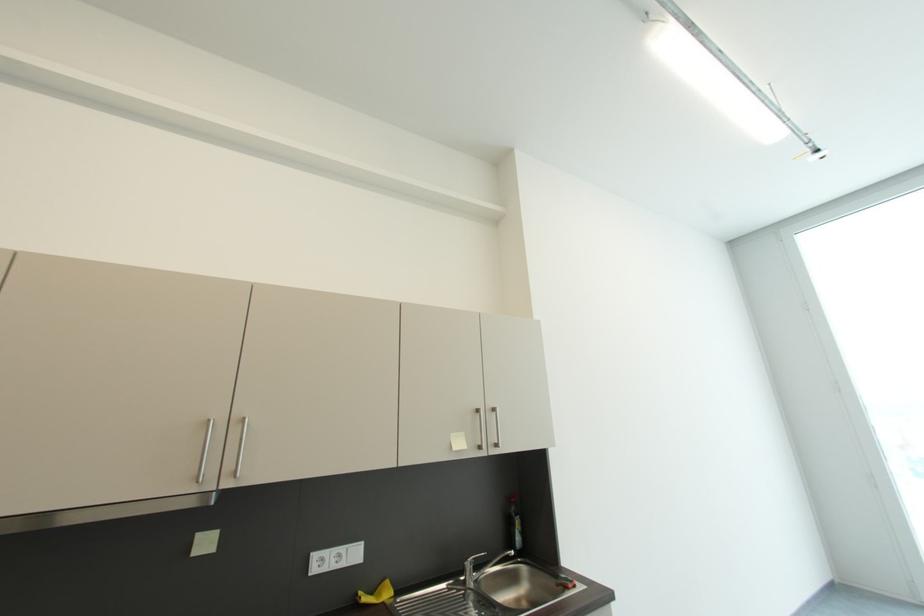
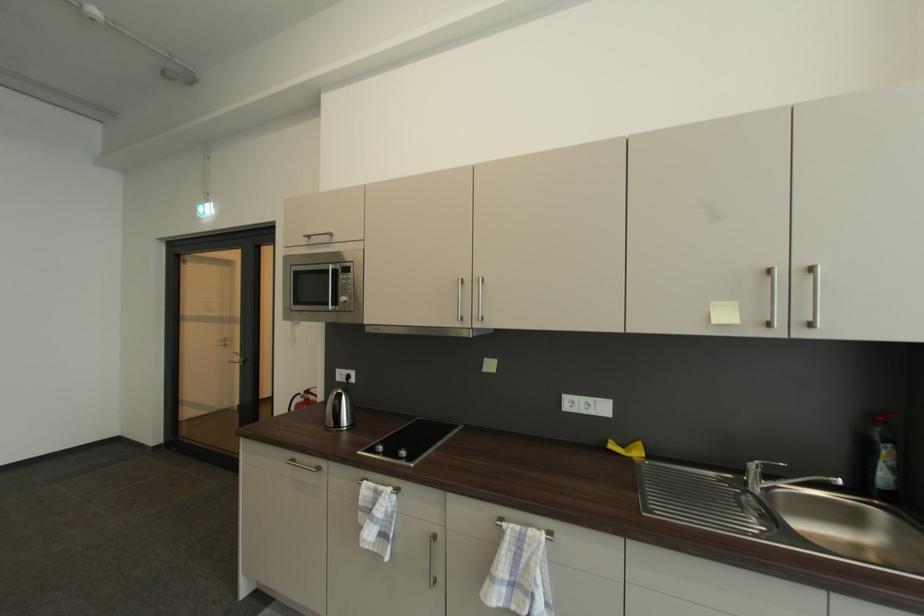
Question: The images are taken continuously from a first-person perspective. In which direction is your viewpoint rotating?

Choices:
 (A) Left
 (B) Right
 (C) Up
 (D) Down

Answer: (A)